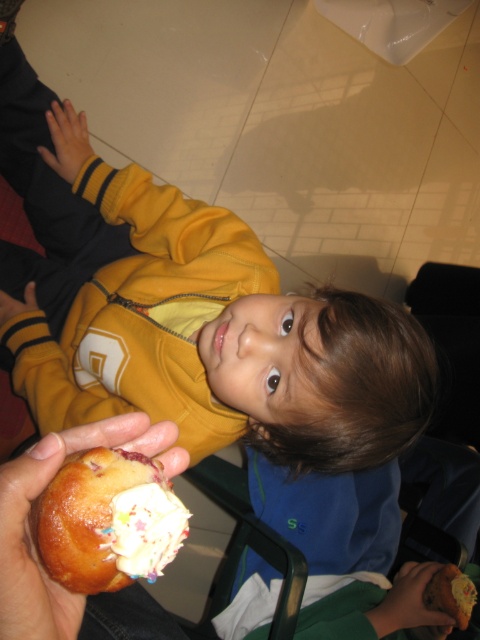
Question: Which is farther from the dark brown leather hand at lower right?

Choices:
 (A) glazed doughnut at lower left
 (B) white glossy frosting at lower center

Answer: (B)

Question: Based on their relative distances, which object is farther from the glazed doughnut at lower left?

Choices:
 (A) dark brown leather hand at lower right
 (B) white glossy frosting at lower center

Answer: (A)

Question: Is glazed doughnut at lower left wider than white glossy frosting at lower center?

Choices:
 (A) no
 (B) yes

Answer: (B)

Question: Does white glossy frosting at lower center have a lesser width compared to dark brown leather hand at lower right?

Choices:
 (A) yes
 (B) no

Answer: (A)

Question: Which point is closer to the camera?

Choices:
 (A) glazed doughnut at lower left
 (B) dark brown leather hand at lower right
 (C) white glossy frosting at lower center

Answer: (C)

Question: Does white glossy frosting at lower center appear over dark brown leather hand at lower right?

Choices:
 (A) no
 (B) yes

Answer: (B)